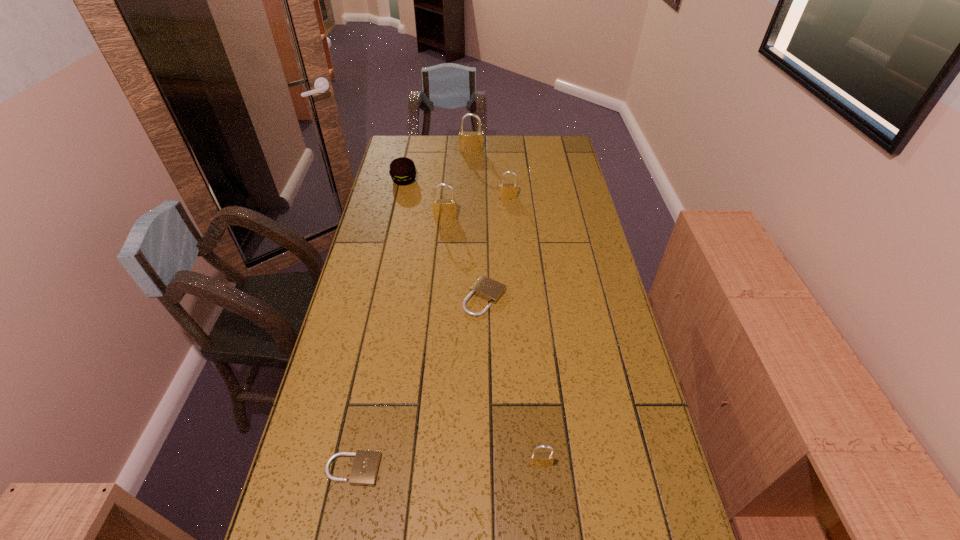
You are a GUI agent. You are given a task and a screenshot of the screen. Output one action in this format:
    pyautogui.click(x=<x>, y=<y>)
    Task: Click on the tallest padlock
    The image size is (960, 540).
    Given the screenshot: What is the action you would take?
    pyautogui.click(x=469, y=142)

At what (x,y) coordinates should I click in order to perform the action: click on the farthest object. Please return your answer as a coordinate pair (x, y). Looking at the image, I should click on (469, 142).

At what (x,y) coordinates should I click in order to perform the action: click on the second nearest brass padlock. Please return your answer as a coordinate pair (x, y). Image resolution: width=960 pixels, height=540 pixels. Looking at the image, I should click on (445, 209).

You are a GUI agent. You are given a task and a screenshot of the screen. Output one action in this format:
    pyautogui.click(x=<x>, y=<y>)
    Task: Click on the fourth nearest padlock
    
    Given the screenshot: What is the action you would take?
    pyautogui.click(x=445, y=209)

Identify the location of the fourth shortest padlock. This screenshot has width=960, height=540. (507, 191).

Where is `the fifth shortest object`? Image resolution: width=960 pixels, height=540 pixels. the fifth shortest object is located at coordinates (507, 191).

Where is `the second farthest object`? the second farthest object is located at coordinates (402, 170).

At what (x,y) coordinates should I click in order to perform the action: click on the third shortest padlock. Please return your answer as a coordinate pair (x, y). Looking at the image, I should click on (537, 459).

Identify the location of the nearest brass padlock. (537, 459).

The image size is (960, 540). Find the location of `the right beige padlock`. the right beige padlock is located at coordinates (486, 288).